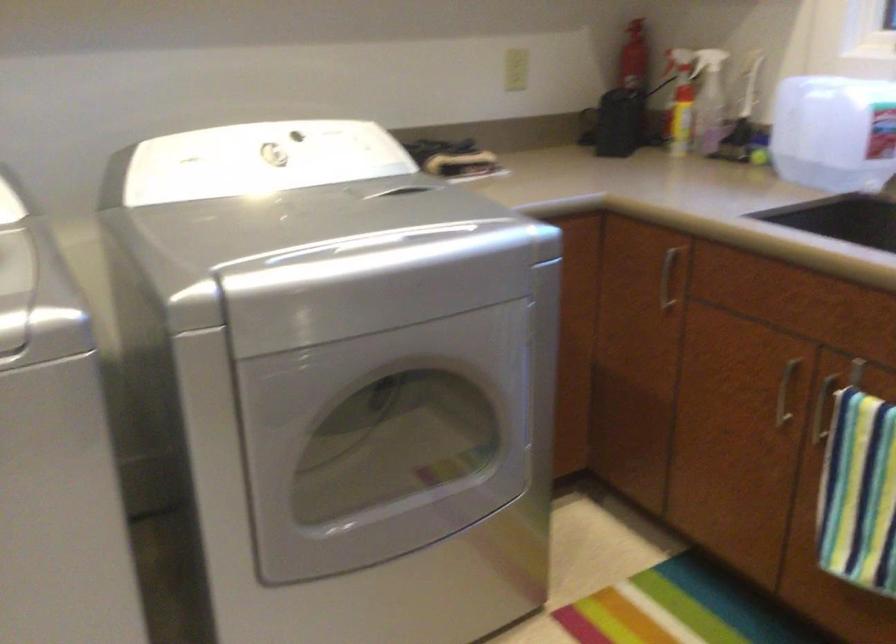
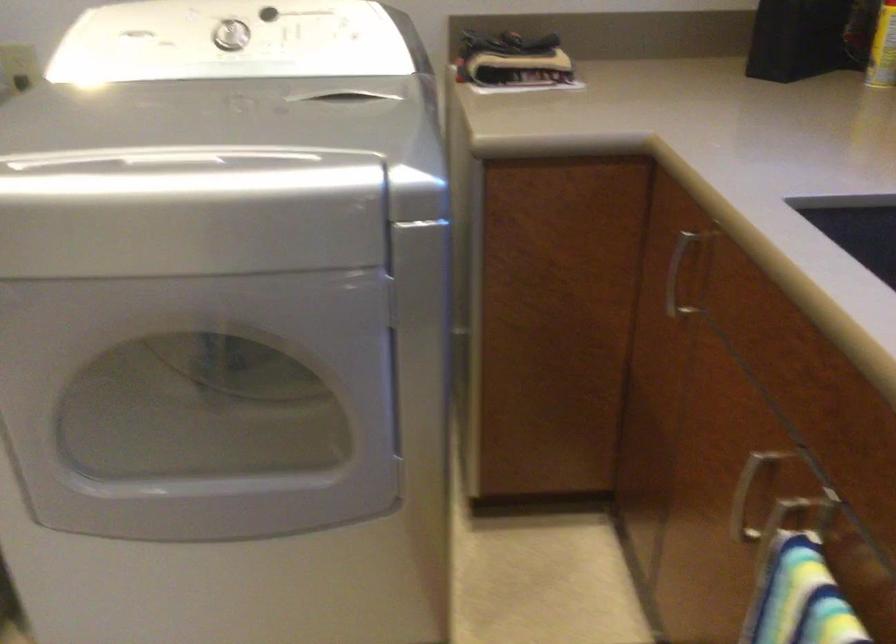
Locate, in the second image, the point that corresponds to point 652,283 in the first image.

(677, 275)